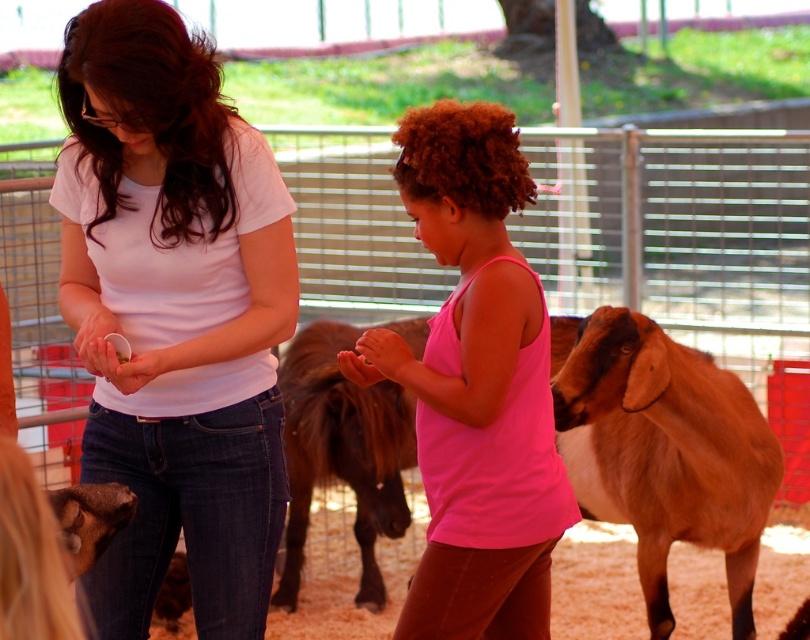
You are a zookeeper who needs to hand out food to visitors. You have a limited amount of snacks. The pink matte tank top at center and the brown woolen goat at right are both in the enclosure. Which one requires more snacks based on their size?

The brown woolen goat at right requires more snacks because it is larger than the pink matte tank top at center.

Consider the image. You are a visitor at the petting zoo and want to know which object is taller between the matte white shirt at center and the brown fuzzy pony at center without looking. Can you determine which one is taller?

The matte white shirt at center is much taller than the brown fuzzy pony at center according to the description.